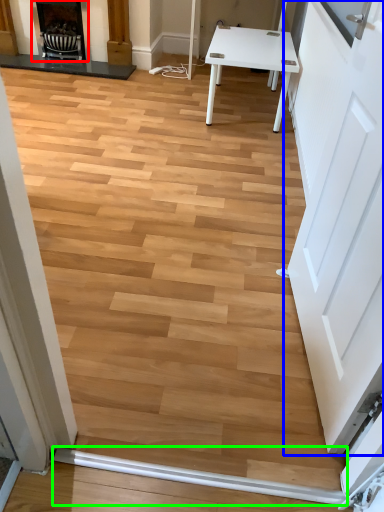
Question: Based on their relative distances, which object is nearer to fireplace (highlighted by a red box)? Choose from door (highlighted by a blue box) and beam (highlighted by a green box).

Choices:
 (A) door
 (B) beam

Answer: (A)